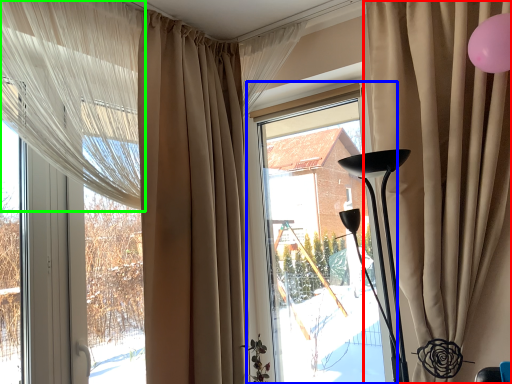
Question: Estimate the real-world distances between objects in this image. Which object is farther from curtain (highlighted by a red box), window (highlighted by a blue box) or curtain (highlighted by a green box)?

Choices:
 (A) window
 (B) curtain

Answer: (B)